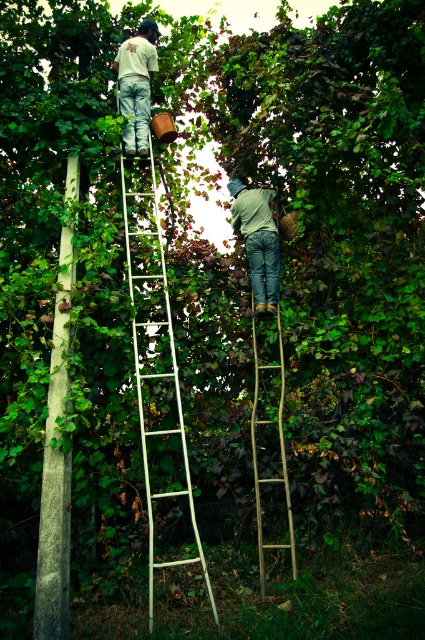
The image size is (425, 640). What do you see at coordinates (56, 468) in the screenshot? I see `gray concrete pole at left` at bounding box center [56, 468].

Who is lower down, gray concrete pole at left or bamboo ladder at center?

Positioned lower is bamboo ladder at center.

The height and width of the screenshot is (640, 425). I want to click on gray concrete pole at left, so click(56, 468).

Who is more forward, [47,435] or [133,92]?

Positioned in front is point [47,435].

This screenshot has width=425, height=640. What do you see at coordinates (56, 468) in the screenshot?
I see `gray concrete pole at left` at bounding box center [56, 468].

Image resolution: width=425 pixels, height=640 pixels. I want to click on gray concrete pole at left, so click(56, 468).

Is point (181, 440) farther from viewer compared to point (261, 582)?

Yes, it is behind point (261, 582).

Is white metal ladder at center to the right of bamboo ladder at center from the viewer's perspective?

No, white metal ladder at center is not to the right of bamboo ladder at center.

Which is behind, point (156, 323) or point (277, 412)?

The point (156, 323) is behind.

Identify the location of white metal ladder at center. This screenshot has height=640, width=425. (153, 340).